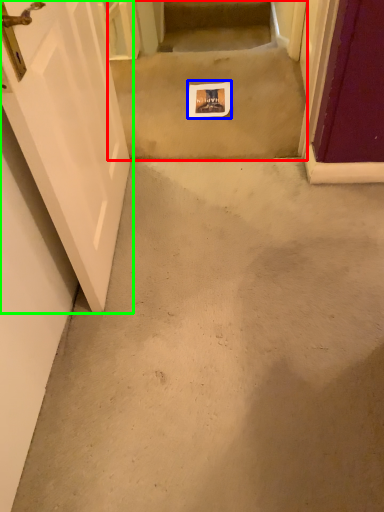
Question: Which object is the closest to the stairwell (highlighted by a red box)? Choose among these: postcard (highlighted by a blue box) or door (highlighted by a green box).

Choices:
 (A) postcard
 (B) door

Answer: (A)